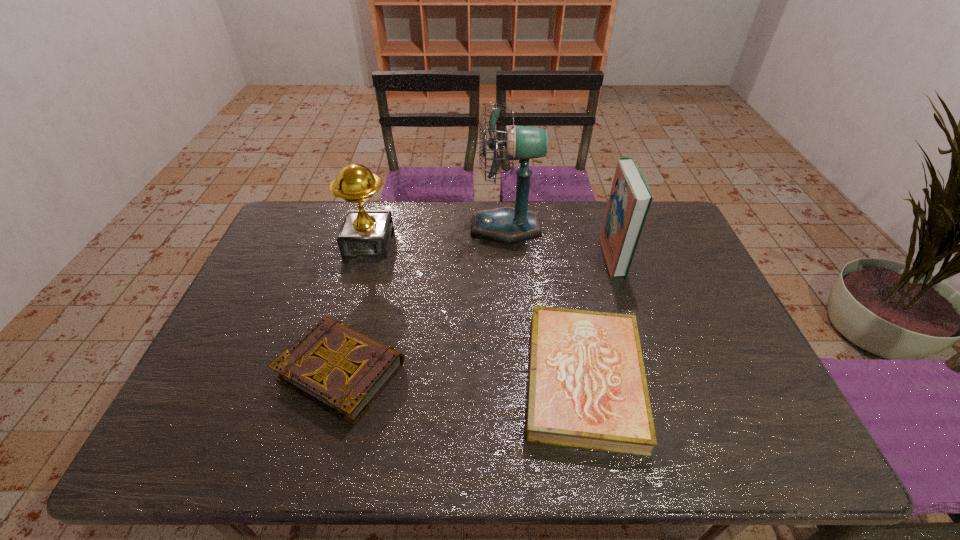
Locate an element on the screen. The image size is (960, 540). free region located on the front-facing side of the award is located at coordinates (347, 321).

Where is `vacant space located 0.190m on the left of the leftmost hardback book`? This screenshot has height=540, width=960. vacant space located 0.190m on the left of the leftmost hardback book is located at coordinates (204, 371).

Identify the location of fan present at the far edge. (506, 224).

Identify the location of hardback book present at the far edge. (630, 198).

This screenshot has width=960, height=540. I want to click on award located at the far edge, so click(364, 233).

Identify the location of vacant position at the far edge of the desktop. Image resolution: width=960 pixels, height=540 pixels. (451, 210).

What are the coordinates of `vacant space at the near edge` in the screenshot? It's located at (439, 456).

In the image, there is a desktop. At what (x,y) coordinates should I click in order to perform the action: click on vacant region at the left edge. Please return your answer as a coordinate pair (x, y). The height and width of the screenshot is (540, 960). Looking at the image, I should click on (249, 298).

Image resolution: width=960 pixels, height=540 pixels. Find the location of `vacant position at the right edge of the desktop`. vacant position at the right edge of the desktop is located at coordinates (685, 268).

In order to click on free space between the tallest object and the award in this screenshot , I will do `click(437, 235)`.